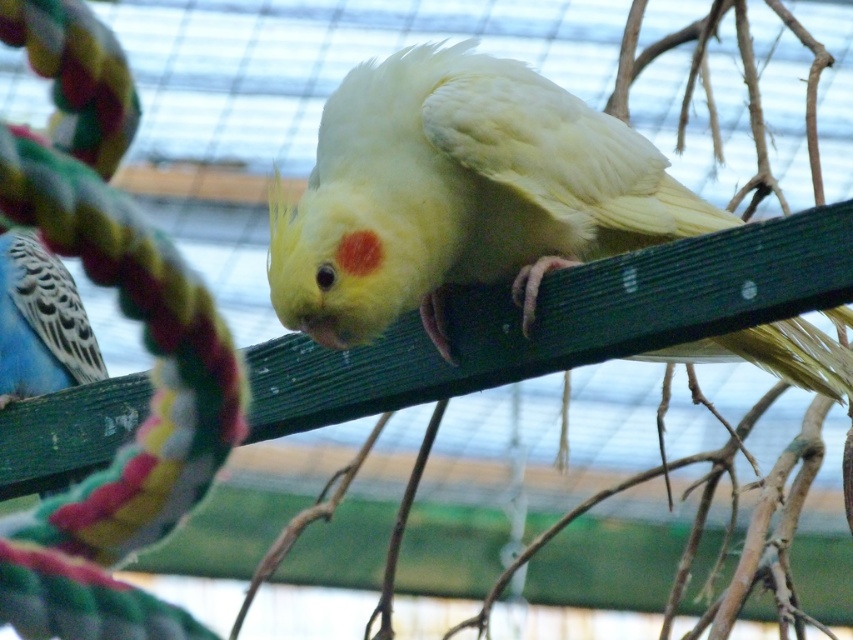
Consider the image. Is white feathered parrot at center bigger than blue speckled parrot at left?

Yes, white feathered parrot at center is bigger than blue speckled parrot at left.

Is point (286, 227) positioned after point (39, 275)?

No.

Where is `white feathered parrot at center`? white feathered parrot at center is located at coordinates (460, 195).